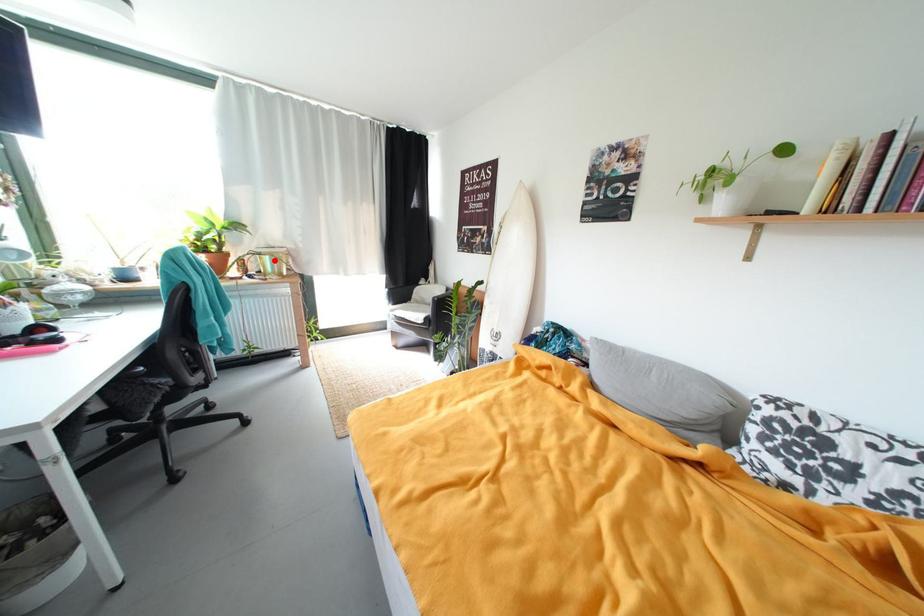
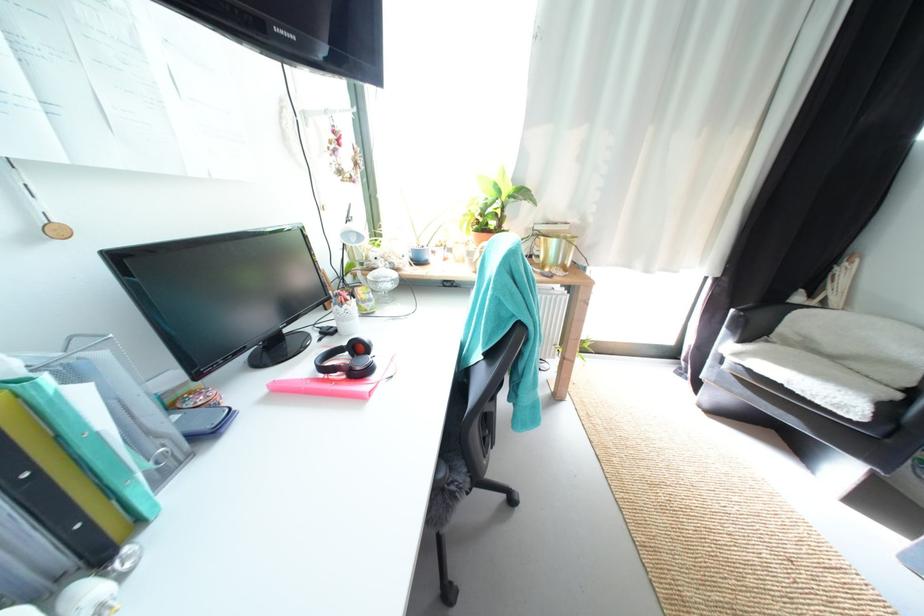
Question: A red point is marked in image1. In image2, is the corresponding 3D point closer to the camera or farther? Reply with the corresponding letter.

Choices:
 (A) The corresponding 3D point is closer.
 (B) The corresponding 3D point is farther.

Answer: (B)